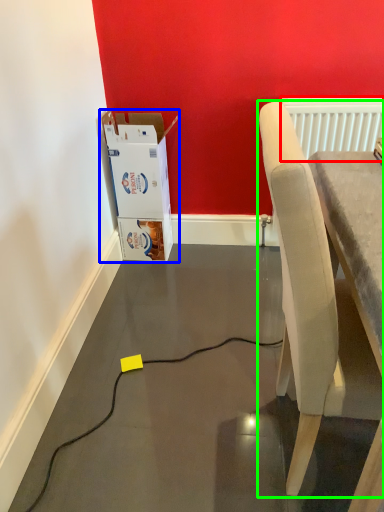
Question: Estimate the real-world distances between objects in this image. Which object is farther from radiator (highlighted by a red box), cardboard box (highlighted by a blue box) or chair (highlighted by a green box)?

Choices:
 (A) cardboard box
 (B) chair

Answer: (B)